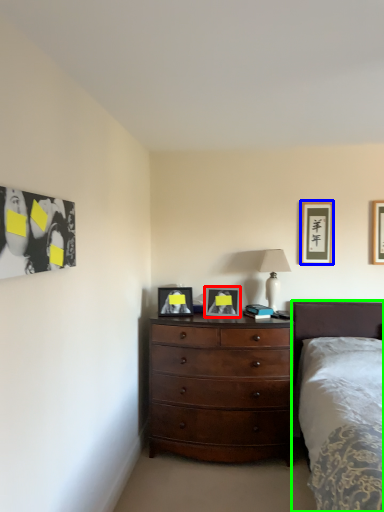
Question: Considering the real-world distances, which object is closest to picture frame (highlighted by a red box)? picture frame (highlighted by a blue box) or bed (highlighted by a green box).

Choices:
 (A) picture frame
 (B) bed

Answer: (B)